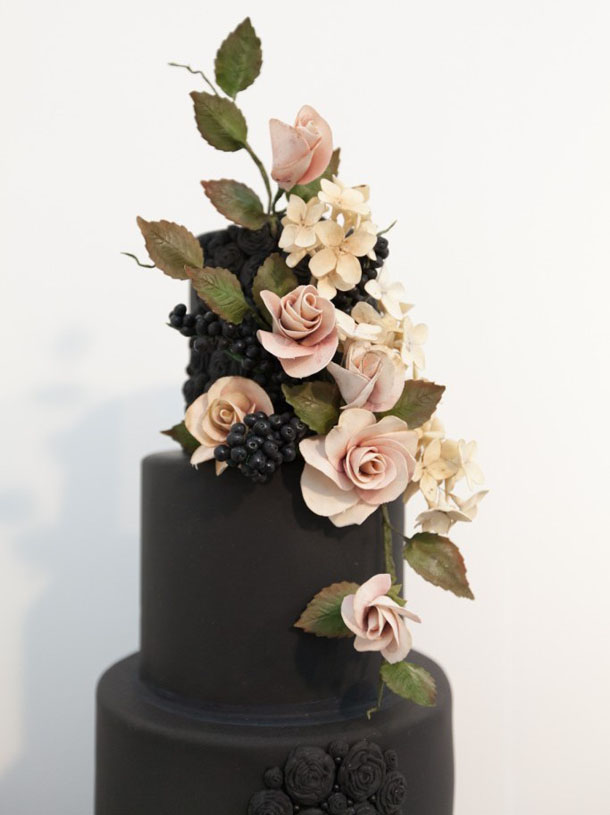
This screenshot has width=610, height=815. Find the location of `wall`. wall is located at coordinates (549, 481).